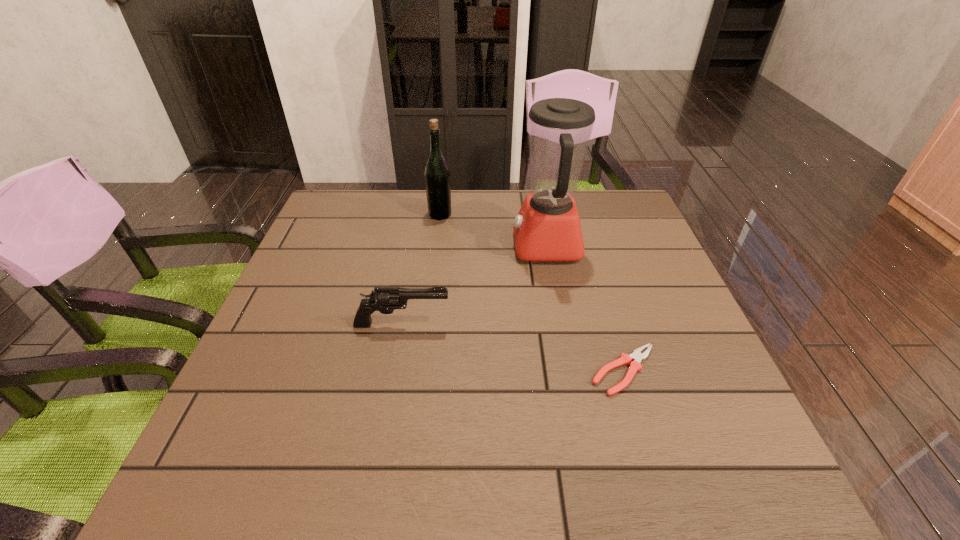
Locate an element on the screen. empty location between the gun and the shortest object is located at coordinates (513, 347).

Where is `free space between the gun and the blender`? The height and width of the screenshot is (540, 960). free space between the gun and the blender is located at coordinates coord(474,285).

The image size is (960, 540). Identify the location of free space between the nearest object and the second shortest object. pyautogui.click(x=513, y=347).

Identify the location of free space between the shortest object and the second nearest object. (513, 347).

Identify the location of vacant area that lies between the beer bottle and the tallest object. (493, 230).

You are a GUI agent. You are given a task and a screenshot of the screen. Output one action in this format:
    pyautogui.click(x=<x>, y=<y>)
    Task: Click on the vacant space in between the third shortest object and the tallest object
    
    Given the screenshot: What is the action you would take?
    pyautogui.click(x=493, y=230)

Find the location of a particular element. free spot between the blender and the farthest object is located at coordinates (493, 230).

This screenshot has width=960, height=540. I want to click on vacant space that is in between the farthest object and the third farthest object, so click(x=421, y=269).

This screenshot has height=540, width=960. Identify the location of unoccupied area between the pliers and the second tallest object. (532, 293).

Locate an element on the screen. This screenshot has height=540, width=960. unoccupied area between the second farthest object and the nearest object is located at coordinates (586, 308).